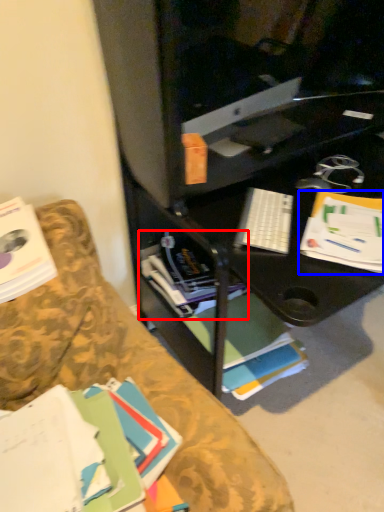
Question: Among these objects, which one is farthest to the camera, book (highlighted by a red box) or paperback book (highlighted by a blue box)?

Choices:
 (A) book
 (B) paperback book

Answer: (A)